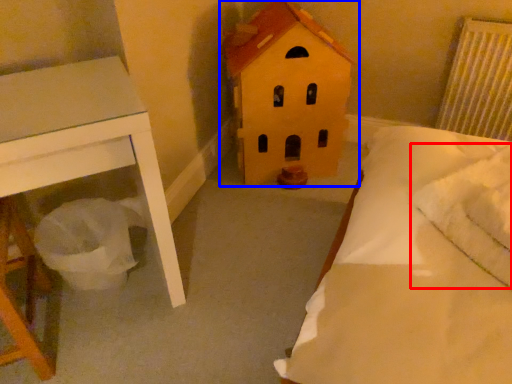
Question: Which point is closer to the camera, pillow (highlighted by a red box) or toy (highlighted by a blue box)?

Choices:
 (A) pillow
 (B) toy

Answer: (A)